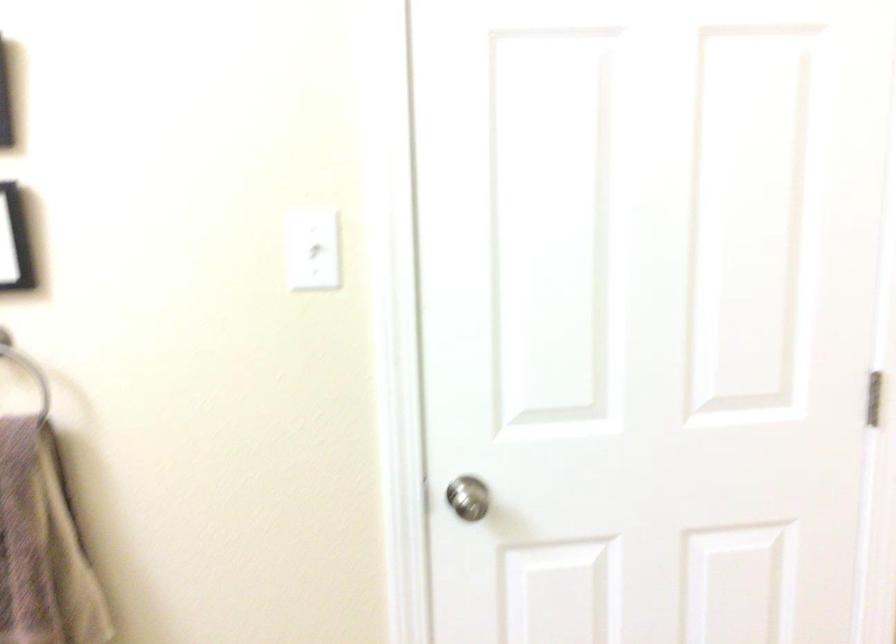
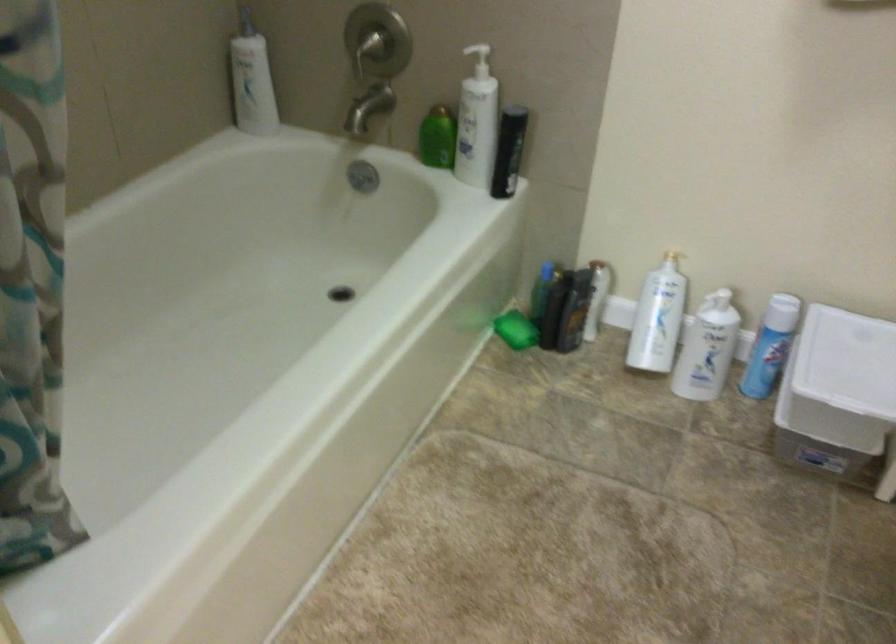
First-person continuous shooting, in which direction is the camera rotating?

The camera's rotation is toward right-down.